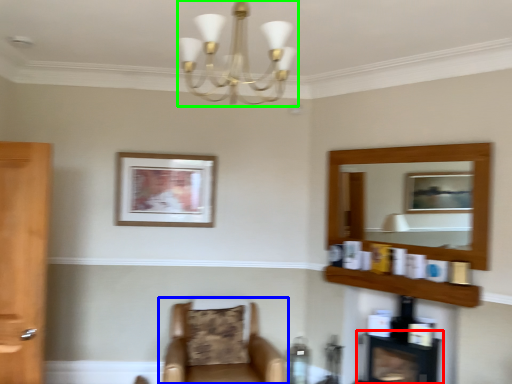
Question: Considering the real-world distances, which object is closest to fireplace (highlighted by a red box)? chair (highlighted by a blue box) or light fixture (highlighted by a green box).

Choices:
 (A) chair
 (B) light fixture

Answer: (A)